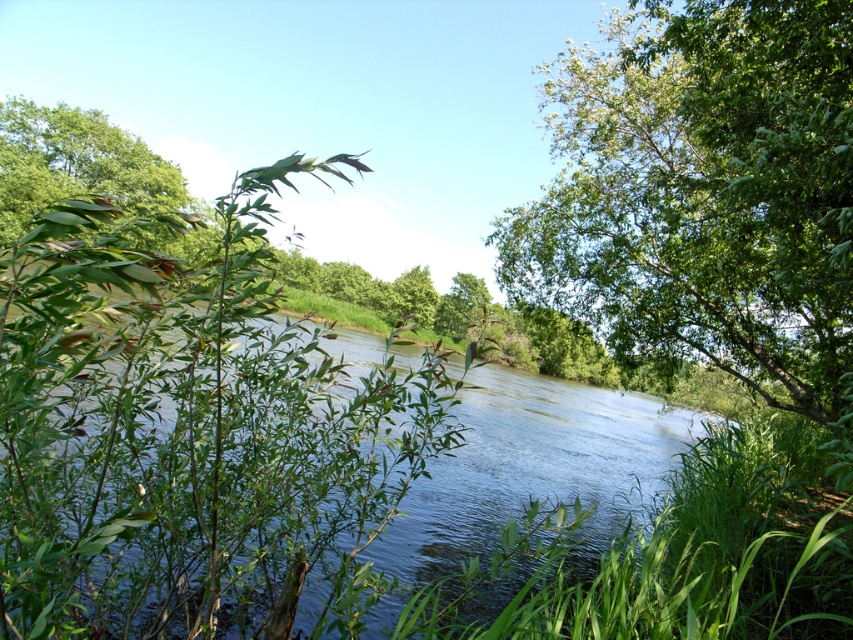
Does green leafy river at center have a lesser height compared to green leafy tree at center?

Yes.

Is point (511, 627) positioned after point (656, 198)?

No.

Identify the location of green leafy river at center. The width and height of the screenshot is (853, 640). (202, 472).

Does green leafy tree at center have a lesser width compared to green leafy tree at upper left?

Indeed, green leafy tree at center has a lesser width compared to green leafy tree at upper left.

Who is more distant from viewer, (755,372) or (155,168)?

The point (155,168) is behind.

Image resolution: width=853 pixels, height=640 pixels. Identify the location of green leafy tree at center. (703, 193).

Is green leafy river at center bigger than green leafy tree at upper left?

No.

Which is in front, point (437, 394) or point (18, 205)?

Point (437, 394) is in front.

The width and height of the screenshot is (853, 640). Identify the location of green leafy river at center. (202, 472).